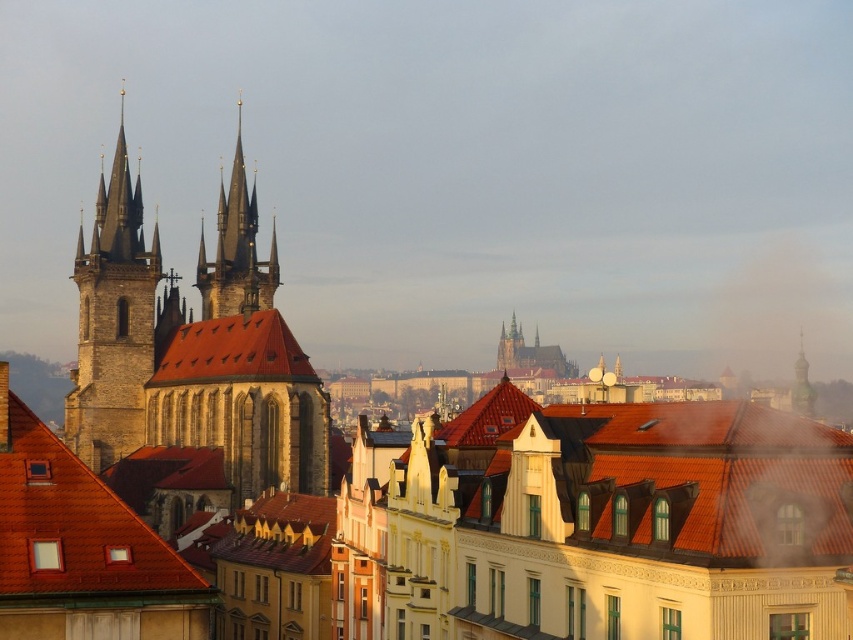
Question: From the image, what is the correct spatial relationship of golden stone spire at center in relation to gold textured spire at upper right?

Choices:
 (A) right
 (B) left

Answer: (B)

Question: Can you confirm if brown tile roof at lower left is smaller than brown tile roof at center?

Choices:
 (A) no
 (B) yes

Answer: (B)

Question: Which point appears farthest from the camera in this image?

Choices:
 (A) [805, 385]
 (B) [88, 364]
 (C) [114, 560]
 (D) [228, 202]

Answer: (A)

Question: Based on their relative distances, which object is farther from the brown stone church at left?

Choices:
 (A) gold textured spire at upper right
 (B) stone spire at left

Answer: (A)

Question: Does golden stone spire at center appear over gold textured spire at upper right?

Choices:
 (A) no
 (B) yes

Answer: (B)

Question: Which of the following is the closest to the observer?

Choices:
 (A) (207, 342)
 (B) (242, 163)
 (C) (136, 356)

Answer: (A)